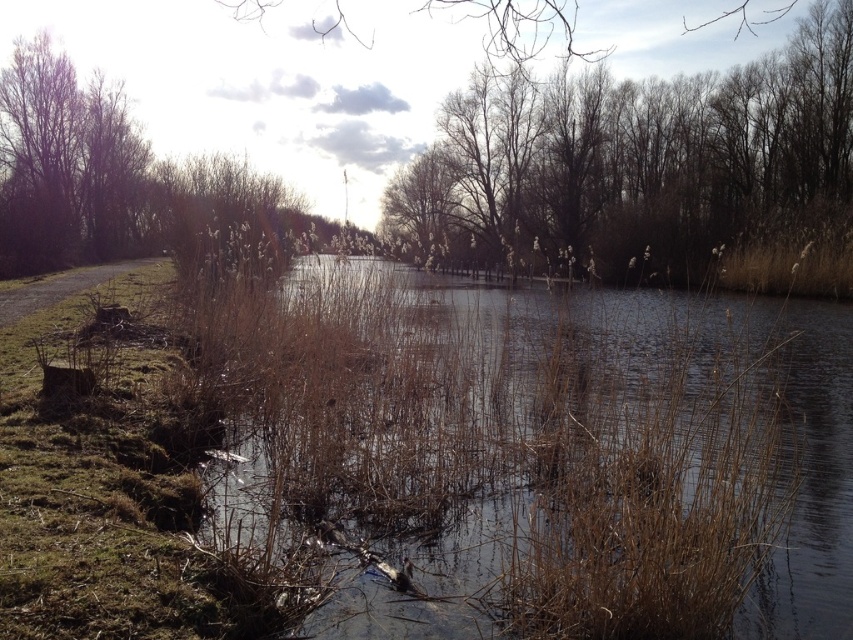
Which of these two, bare branches at upper center or brown bare branches at upper left, stands shorter?

Standing shorter between the two is brown bare branches at upper left.

Can you confirm if bare branches at upper center is shorter than brown bare branches at upper left?

In fact, bare branches at upper center may be taller than brown bare branches at upper left.

Between point (762, 214) and point (28, 236), which one is positioned in front?

Point (28, 236)

Find the location of a particular element. bare branches at upper center is located at coordinates (641, 163).